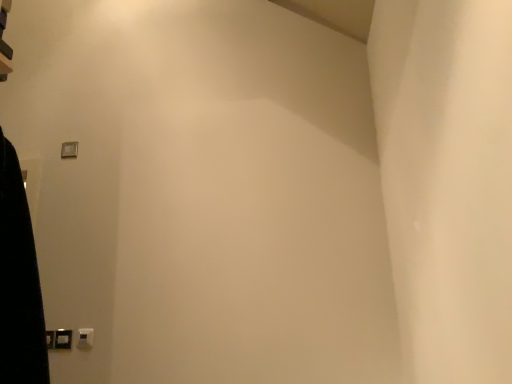
Where is `white plastic light switch at lower left`? This screenshot has width=512, height=384. white plastic light switch at lower left is located at coordinates (85, 338).

The width and height of the screenshot is (512, 384). Describe the element at coordinates (85, 338) in the screenshot. I see `white plastic light switch at lower left` at that location.

In order to click on white plastic light switch at lower left in this screenshot , I will do `click(85, 338)`.